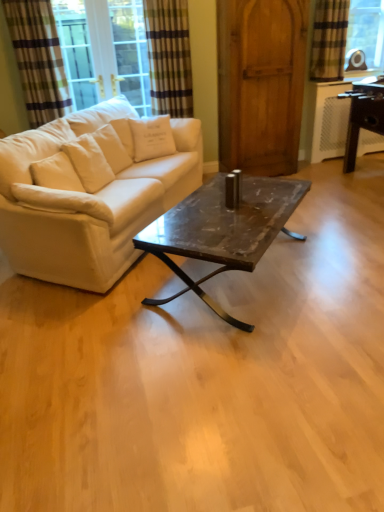
Locate an element on the screen. free space that is to the left of marble/black metal coffee table at center is located at coordinates (84, 316).